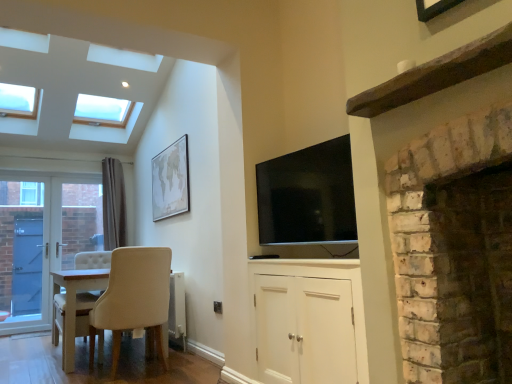
Question: From a real-world perspective, is white wooden door at left physically located above or below white matte cabinet at center?

Choices:
 (A) above
 (B) below

Answer: (A)

Question: Looking at the image, does white wooden door at left seem bigger or smaller compared to white matte cabinet at center?

Choices:
 (A) big
 (B) small

Answer: (B)

Question: Which is farther from the white wooden door at left?

Choices:
 (A) white matte cabinet at center
 (B) beige matte map at upper center
 (C) blue glass door at left
 (D) white brick fireplace at right
 (E) beige fabric chair at lower left

Answer: (D)

Question: Which of these objects is positioned farthest from the white matte cabinet at center?

Choices:
 (A) white wooden door at left
 (B) beige fabric chair at lower left
 (C) beige matte map at upper center
 (D) flat screen tv at upper center
 (E) blue glass door at left

Answer: (E)